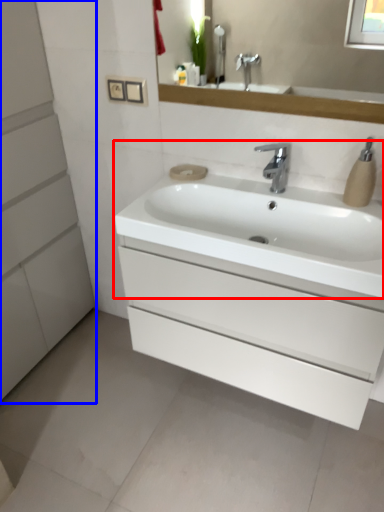
Question: Which object appears farthest to the camera in this image, sink (highlighted by a red box) or bathroom cabinet (highlighted by a blue box)?

Choices:
 (A) sink
 (B) bathroom cabinet

Answer: (A)